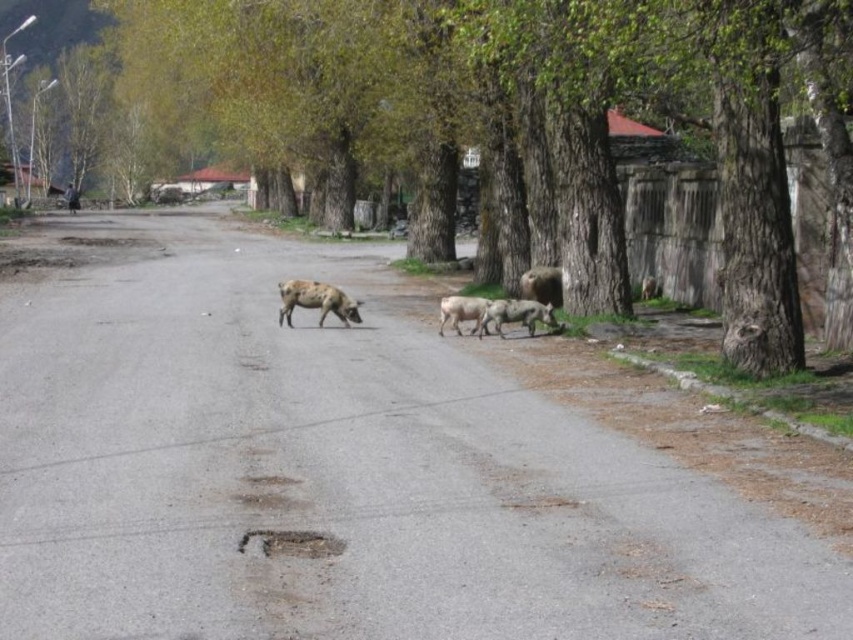
Is brown rough tree at center positioned in front of speckled woolen sheep at center?

Yes, brown rough tree at center is in front of speckled woolen sheep at center.

Is brown rough tree at center below speckled woolen sheep at center?

Incorrect, brown rough tree at center is not positioned below speckled woolen sheep at center.

The image size is (853, 640). Describe the element at coordinates (486, 129) in the screenshot. I see `brown rough tree at center` at that location.

This screenshot has width=853, height=640. Find the location of `brown rough tree at center`. brown rough tree at center is located at coordinates (486, 129).

Which of these two, brown rough tree at center or brown woolen sheep at right, stands shorter?

Standing shorter between the two is brown woolen sheep at right.

Does point (119, 144) come farther from viewer compared to point (527, 298)?

That is True.

Where is `brown rough tree at center`? Image resolution: width=853 pixels, height=640 pixels. brown rough tree at center is located at coordinates (486, 129).

Based on the photo, between brown rough tree at center and white woolen sheep at center, which one has less height?

white woolen sheep at center is shorter.

Can you confirm if brown rough tree at center is positioned to the left of white woolen sheep at center?

Correct, you'll find brown rough tree at center to the left of white woolen sheep at center.

Does point (503, 204) come behind point (445, 298)?

That is True.

You are a GUI agent. You are given a task and a screenshot of the screen. Output one action in this format:
    pyautogui.click(x=<x>, y=<y>)
    Task: Click on the brown rough tree at center
    Image resolution: width=853 pixels, height=640 pixels.
    Given the screenshot: What is the action you would take?
    pyautogui.click(x=486, y=129)